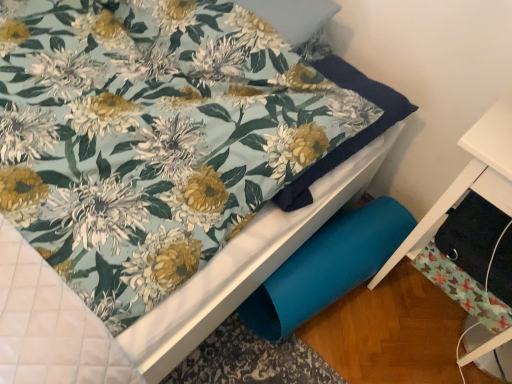
Question: Is point (497, 157) closer or farther from the camera than point (453, 261)?

Choices:
 (A) closer
 (B) farther

Answer: (A)

Question: From their relative heights in the image, would you say black fabric drawer at lower right is taller or shorter than black fabric drawer at lower right?

Choices:
 (A) short
 (B) tall

Answer: (B)

Question: Looking at the image, does black fabric drawer at lower right seem bigger or smaller compared to black fabric drawer at lower right?

Choices:
 (A) big
 (B) small

Answer: (A)

Question: Considering their positions, is black fabric drawer at lower right located in front of or behind black fabric drawer at lower right?

Choices:
 (A) front
 (B) behind

Answer: (B)

Question: From a real-world perspective, is black fabric drawer at lower right positioned above or below black fabric drawer at lower right?

Choices:
 (A) below
 (B) above

Answer: (B)

Question: In terms of height, does black fabric drawer at lower right look taller or shorter compared to black fabric drawer at lower right?

Choices:
 (A) short
 (B) tall

Answer: (A)

Question: Considering the positions of black fabric drawer at lower right and black fabric drawer at lower right in the image, is black fabric drawer at lower right wider or thinner than black fabric drawer at lower right?

Choices:
 (A) thin
 (B) wide

Answer: (A)